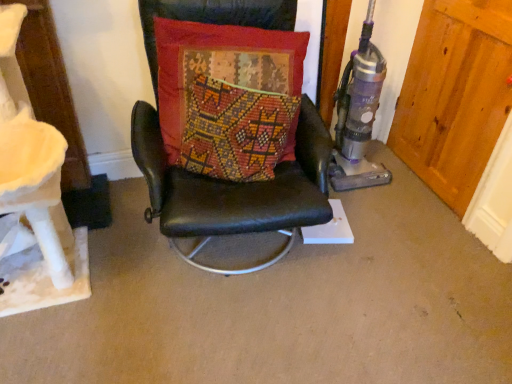
Question: From the image's perspective, relative to wooden door at right, is textured red cushion at center above or below?

Choices:
 (A) above
 (B) below

Answer: (B)

Question: Is point (259, 52) closer or farther from the camera than point (495, 19)?

Choices:
 (A) farther
 (B) closer

Answer: (B)

Question: Which object is the closest to the textured red cushion at center?

Choices:
 (A) black leather chair at center
 (B) wooden door at right

Answer: (A)

Question: Estimate the real-world distances between objects in this image. Which object is closer to the textured red cushion at center?

Choices:
 (A) wooden door at right
 (B) black leather chair at center

Answer: (B)